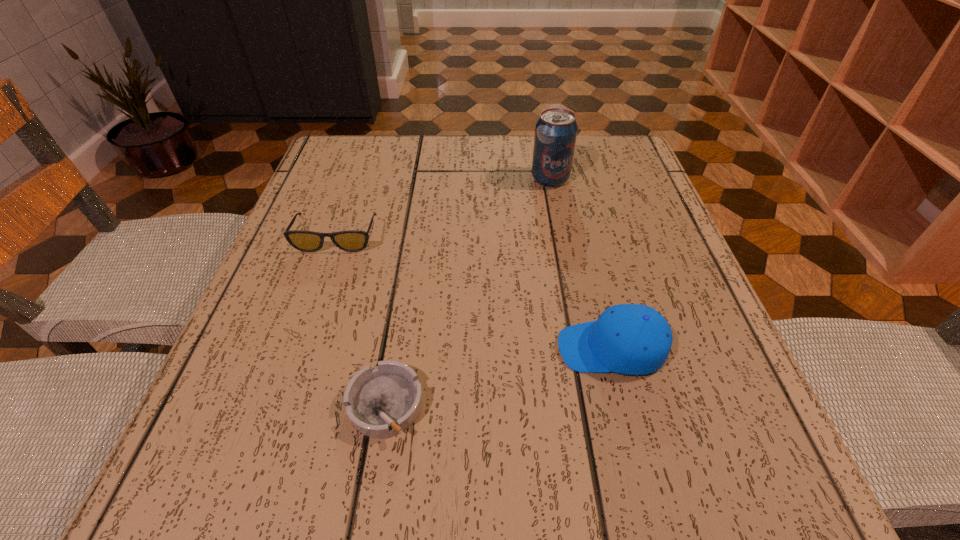
You are a GUI agent. You are given a task and a screenshot of the screen. Output one action in this format:
    pyautogui.click(x=<x>, y=<y>)
    Task: Click on the tallest object
    The image size is (960, 540).
    Given the screenshot: What is the action you would take?
    pyautogui.click(x=556, y=130)

Where is `pop soda`? pop soda is located at coordinates (x=556, y=130).

This screenshot has height=540, width=960. I want to click on cap, so click(x=631, y=339).

You are a GUI agent. You are given a task and a screenshot of the screen. Output one action in this format:
    pyautogui.click(x=<x>, y=<y>)
    Task: Click on the third nearest object
    
    Given the screenshot: What is the action you would take?
    pyautogui.click(x=308, y=241)

Where is `sunglasses`? The image size is (960, 540). sunglasses is located at coordinates (308, 241).

Identify the location of the second object from left to right. (381, 402).

Image resolution: width=960 pixels, height=540 pixels. I want to click on the shortest object, so click(x=381, y=402).

This screenshot has width=960, height=540. Find the location of `vacant region located on the right of the pop soda`. vacant region located on the right of the pop soda is located at coordinates (618, 179).

Find the location of a particular element. The image size is (960, 540). free location located 0.360m on the front-facing side of the cap is located at coordinates (324, 348).

At what (x,y) coordinates should I click in order to perform the action: click on free space located 0.400m on the front-facing side of the cap. Please return your answer as a coordinate pair (x, y). Looking at the image, I should click on (298, 348).